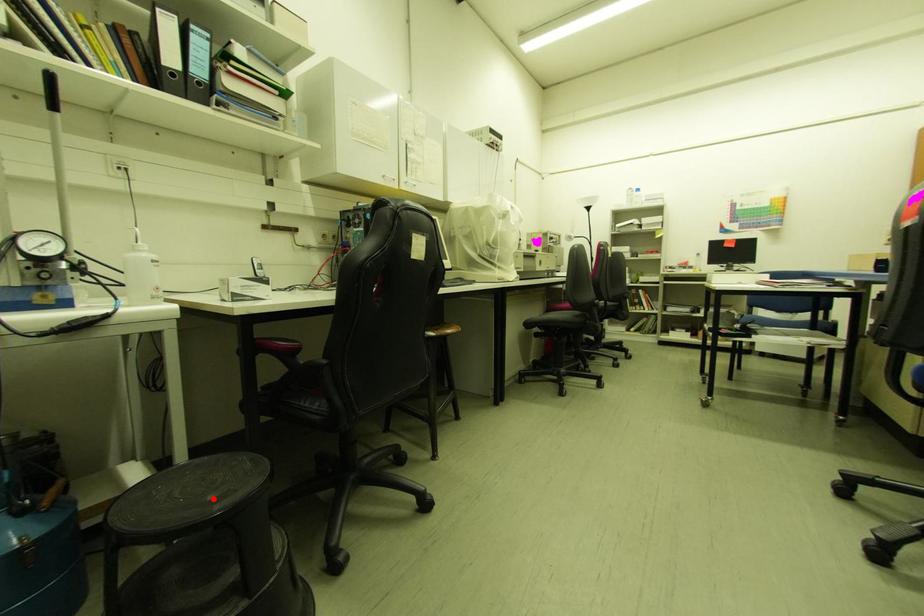
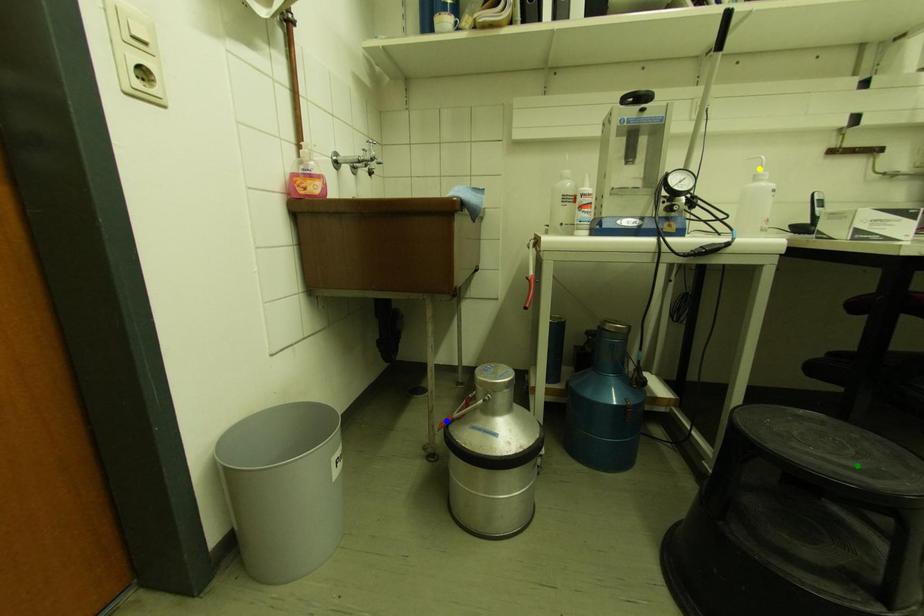
Question: I am providing you with two images of the same scene from different viewpoints. A red point is marked on the first image. You are given multiple points on the second image. Can you choose the point in image 2 that corresponds to the point in image 1?

Choices:
 (A) green point
 (B) blue point
 (C) yellow point

Answer: (A)